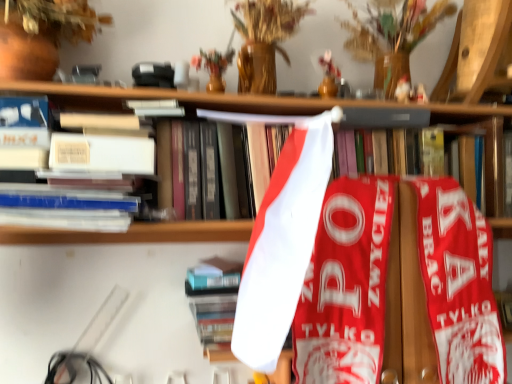
Question: Does hardcover book at center, placed as the first book when sorted from bottom to top, appear on the right side of white paper at upper center, acting as the second book starting from the bottom?

Choices:
 (A) yes
 (B) no

Answer: (B)

Question: Are hardcover book at center, which is counted as the second book, starting from the top, and white paper at upper center, positioned as the 1th book in top-to-bottom order, far apart?

Choices:
 (A) no
 (B) yes

Answer: (A)

Question: Is hardcover book at center, which is counted as the second book, starting from the top, facing towards white paper at upper center, acting as the second book starting from the bottom?

Choices:
 (A) yes
 (B) no

Answer: (B)

Question: Does hardcover book at center, placed as the first book when sorted from bottom to top, come behind white paper at upper center, positioned as the 1th book in top-to-bottom order?

Choices:
 (A) no
 (B) yes

Answer: (B)

Question: Is hardcover book at center, which is counted as the second book, starting from the top, bigger than white paper at upper center, acting as the second book starting from the bottom?

Choices:
 (A) yes
 (B) no

Answer: (B)

Question: Can you confirm if hardcover book at center, placed as the first book when sorted from bottom to top, is smaller than white paper at upper center, acting as the second book starting from the bottom?

Choices:
 (A) no
 (B) yes

Answer: (B)

Question: Is white paper at upper center, acting as the second book starting from the bottom, not within hardcover book at center, which is counted as the second book, starting from the top?

Choices:
 (A) yes
 (B) no

Answer: (A)

Question: Is white paper at upper center, positioned as the 1th book in top-to-bottom order, in contact with hardcover book at center, which is counted as the second book, starting from the top?

Choices:
 (A) no
 (B) yes

Answer: (A)

Question: Is white paper at upper center, positioned as the 1th book in top-to-bottom order, taller than hardcover book at center, placed as the first book when sorted from bottom to top?

Choices:
 (A) no
 (B) yes

Answer: (B)

Question: Is white paper at upper center, acting as the second book starting from the bottom, smaller than hardcover book at center, which is counted as the second book, starting from the top?

Choices:
 (A) yes
 (B) no

Answer: (B)

Question: Is white paper at upper center, positioned as the 1th book in top-to-bottom order, turned away from hardcover book at center, which is counted as the second book, starting from the top?

Choices:
 (A) no
 (B) yes

Answer: (A)

Question: Is white paper at upper center, positioned as the 1th book in top-to-bottom order, facing towards hardcover book at center, which is counted as the second book, starting from the top?

Choices:
 (A) yes
 (B) no

Answer: (B)

Question: Looking at the image, does hardcover book at center, placed as the first book when sorted from bottom to top, seem bigger or smaller compared to white paper at upper center, acting as the second book starting from the bottom?

Choices:
 (A) small
 (B) big

Answer: (A)